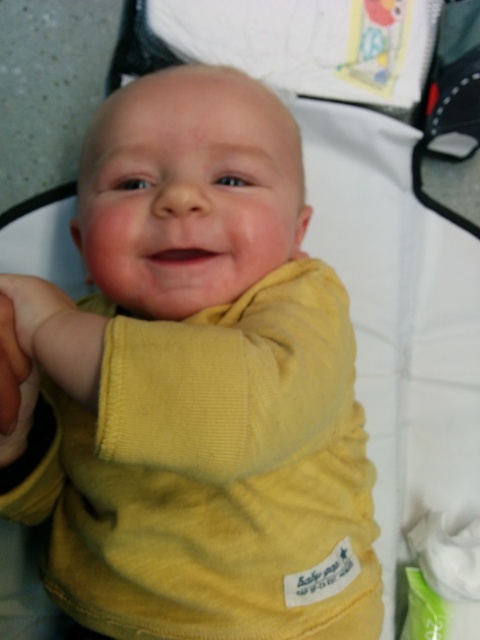
Question: Which object is closer to the camera taking this photo?

Choices:
 (A) white soft cloth at lower right
 (B) yellow corduroy baby at center

Answer: (B)

Question: Is yellow corduroy baby at center thinner than white soft cloth at lower right?

Choices:
 (A) yes
 (B) no

Answer: (B)

Question: Is yellow corduroy baby at center positioned at the back of white soft cloth at lower right?

Choices:
 (A) no
 (B) yes

Answer: (A)

Question: Is yellow corduroy baby at center smaller than white soft cloth at lower right?

Choices:
 (A) no
 (B) yes

Answer: (A)

Question: Among these points, which one is nearest to the camera?

Choices:
 (A) (361, 570)
 (B) (420, 540)

Answer: (A)